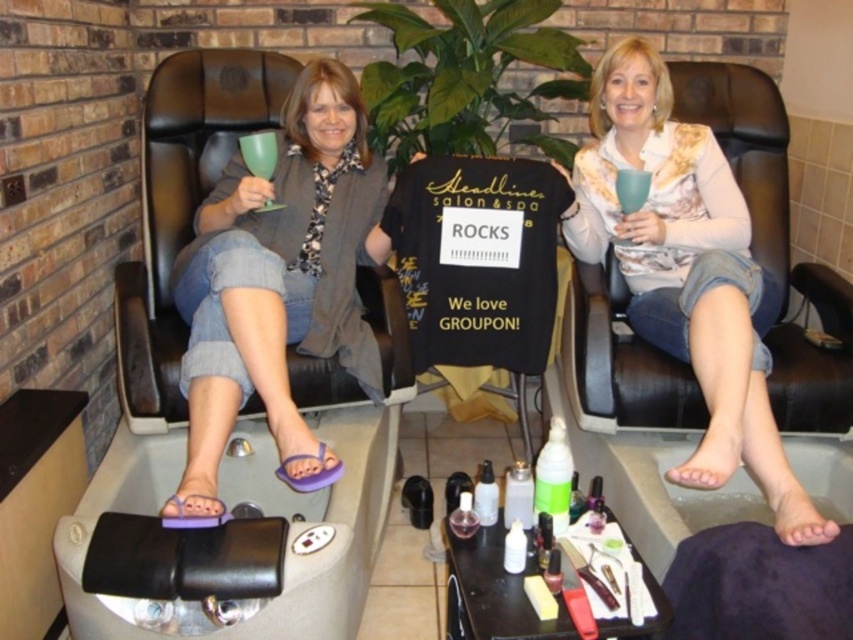
Between purple flip-flops at lower left and matte white shirt at center, which one has less height?

With less height is purple flip-flops at lower left.

Which is in front, point (192, 385) or point (744, 371)?

Point (744, 371)

Image resolution: width=853 pixels, height=640 pixels. What are the coordinates of `purple flip-flops at lower left` in the screenshot? It's located at (277, 288).

Identify the location of purple flip-flops at lower left. (277, 288).